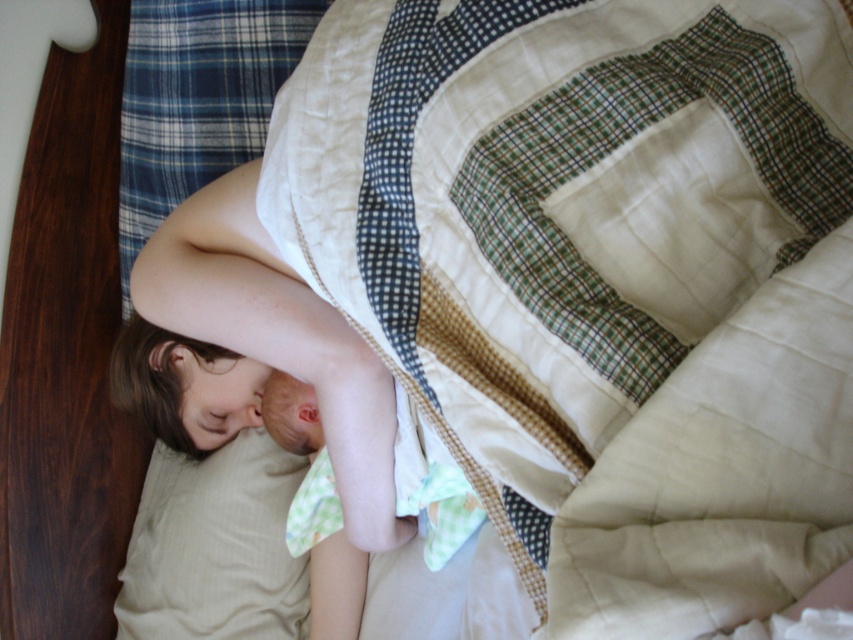
Based on the photo, you are a photographer setting up a shoot in this scene. You want to place a small prop between the smooth skin girl at center and the beige fabric pillow at lower left. Based on their positions, where should you place the prop so it appears in the middle between them from the viewer perspective?

Since the smooth skin girl at center is closer to the viewer than the beige fabric pillow at lower left, the prop should be placed closer to the beige fabric pillow at lower left to appear in the middle between them from the viewer perspective.

You are a photographer taking a closeup shot of the quilted beige blanket at center and the smooth skin girl at center. Which object will appear larger in your photo?

The quilted beige blanket at center will appear larger in the photo because it is closer to the viewer than the smooth skin girl at center.